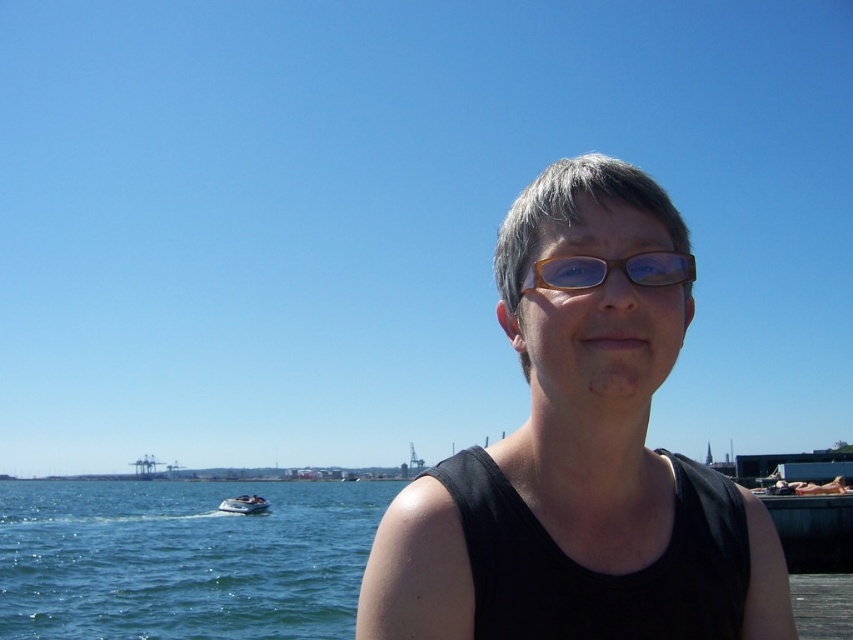
You are a photographer trying to capture the scene with the blue water at lower left and the white glossy boat at lower left. Which object takes up more space in the photo?

The blue water at lower left takes up more space in the photo because it is bigger than the white glossy boat at lower left according to the description.

You are a photographer trying to capture the scene with the black matte tank top at center and the white glossy boat at lower left. Which object appears taller in the photo?

The black matte tank top at center appears taller in the photo because it has a greater height compared to the white glossy boat at lower left according to the description.